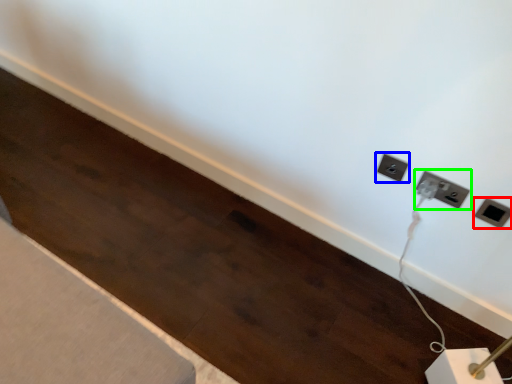
Question: Which object is the closest to the power plugs and sockets (highlighted by a red box)? Choose among these: power plugs and sockets (highlighted by a blue box) or power plugs and sockets (highlighted by a green box).

Choices:
 (A) power plugs and sockets
 (B) power plugs and sockets

Answer: (B)